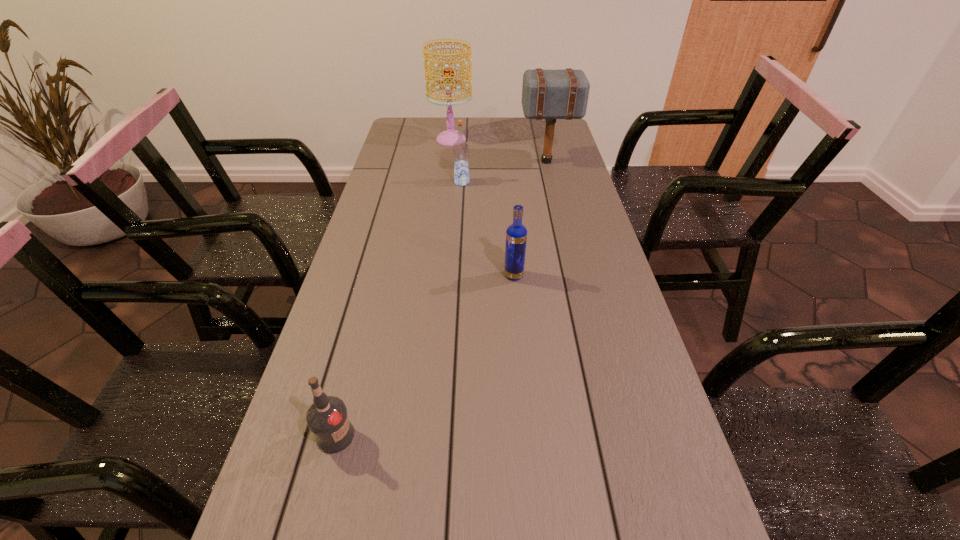
What are the coordinates of `free space located on the striking surface of the mallet` in the screenshot? It's located at (466, 161).

At what (x,y) coordinates should I click in order to perform the action: click on free space located 0.100m on the striking surface of the mallet. Please return your answer as a coordinate pair (x, y). This screenshot has height=540, width=960. Looking at the image, I should click on (492, 161).

The height and width of the screenshot is (540, 960). I want to click on vacant region located on the striking surface of the mallet, so click(x=458, y=161).

Locate an element on the screen. This screenshot has height=540, width=960. vacant space located on the left of the third farthest object is located at coordinates (414, 183).

Find the location of a particular element. The height and width of the screenshot is (540, 960). free space located on the back of the second object from right to left is located at coordinates (512, 253).

This screenshot has height=540, width=960. What are the coordinates of `vacant space situated 0.260m on the front label of the shortest object` in the screenshot? It's located at (491, 436).

Where is `object located at the far edge`? This screenshot has width=960, height=540. object located at the far edge is located at coordinates (450, 136).

Locate an element on the screen. lampshade that is at the left edge is located at coordinates (450, 136).

You are a GUI agent. You are given a task and a screenshot of the screen. Output one action in this format:
    pyautogui.click(x=<x>, y=<y>)
    Task: Click on the vodka that is at the left edge
    
    Given the screenshot: What is the action you would take?
    pyautogui.click(x=327, y=418)

What are the coordinates of `object at the right edge` in the screenshot? It's located at (546, 94).